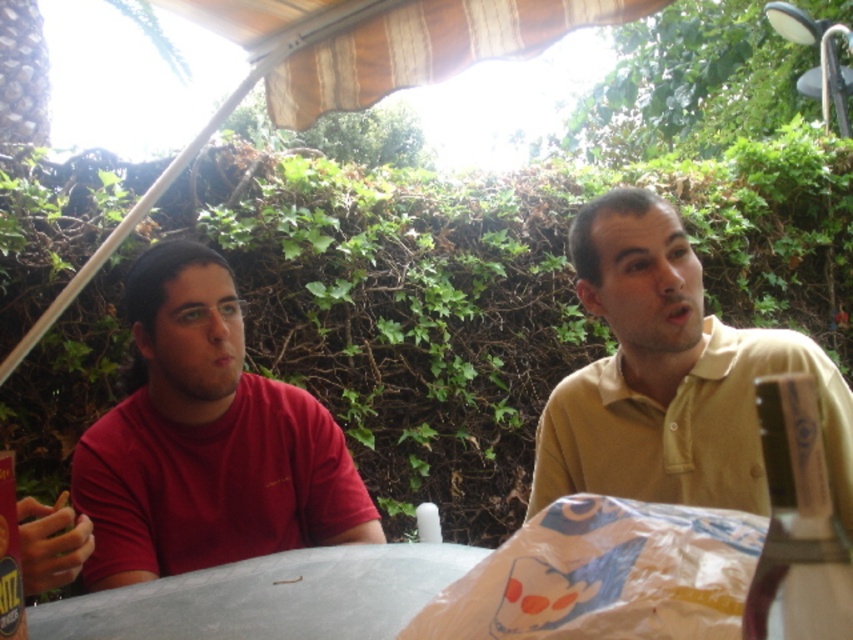
Question: Does wooden box at lower right have a greater width compared to metallic can at left?

Choices:
 (A) no
 (B) yes

Answer: (B)

Question: Estimate the real-world distances between objects in this image. Which object is closer to the matte red shirt at left?

Choices:
 (A) metallic can at left
 (B) yellow matte shirt at center

Answer: (B)

Question: Estimate the real-world distances between objects in this image. Which object is farther from the metallic can at left?

Choices:
 (A) matte red shirt at left
 (B) wooden box at lower right
 (C) yellow matte shirt at center

Answer: (C)

Question: Which object is farther from the camera taking this photo?

Choices:
 (A) metallic can at left
 (B) yellow matte shirt at center
 (C) matte red shirt at left
 (D) wooden box at lower right

Answer: (C)

Question: Is matte red shirt at left positioned behind wooden box at lower right?

Choices:
 (A) no
 (B) yes

Answer: (B)

Question: Is wooden box at lower right below metallic can at left?

Choices:
 (A) yes
 (B) no

Answer: (B)